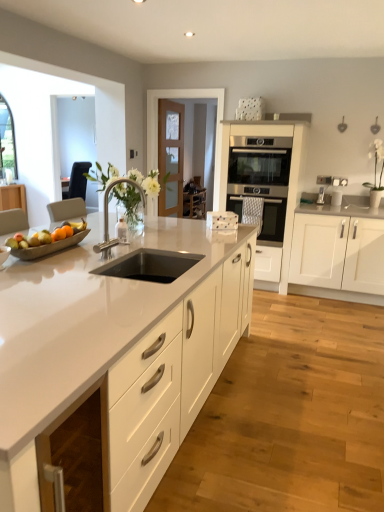
Question: Is white matte cabinet at right, the 3th cabinetry viewed from the left, bigger or smaller than polished chrome faucet at center?

Choices:
 (A) small
 (B) big

Answer: (B)

Question: Considering the positions of white matte cabinet at right, the 1th cabinetry viewed from the right, and polished chrome faucet at center in the image, is white matte cabinet at right, the 1th cabinetry viewed from the right, wider or thinner than polished chrome faucet at center?

Choices:
 (A) thin
 (B) wide

Answer: (B)

Question: Which object is the farthest from the black stainless steel sink at center?

Choices:
 (A) satin silver oven at center
 (B) wooden chair at center
 (C) white glossy cabinet at center, the third cabinetry viewed from the right
 (D) satin stainless steel oven at center, which is the second cabinetry in left-to-right order
 (E) matte gray tray at left

Answer: (B)

Question: Estimate the real-world distances between objects in this image. Which object is farther from the white matte cabinet at right, the 1th cabinetry viewed from the right?

Choices:
 (A) black stainless steel sink at center
 (B) white glossy cabinet at center, placed as the 1th cabinetry when sorted from left to right
 (C) white glossy vase at right
 (D) polished chrome faucet at center
 (E) satin stainless steel oven at center, arranged as the 2th cabinetry when viewed from the right

Answer: (A)